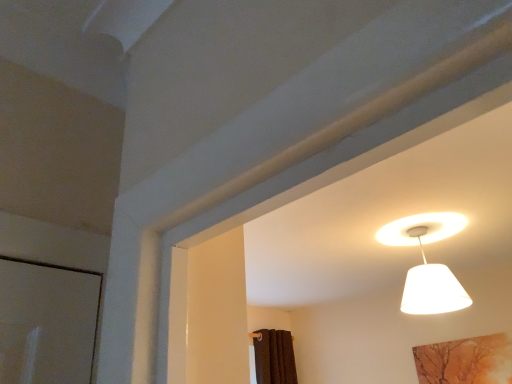
Where is `white fabric lampshade at upper right`? The height and width of the screenshot is (384, 512). white fabric lampshade at upper right is located at coordinates pos(426,263).

Describe the element at coordinates (426, 263) in the screenshot. The image size is (512, 384). I see `white fabric lampshade at upper right` at that location.

Where is `white fabric lampshade at upper right`? The height and width of the screenshot is (384, 512). white fabric lampshade at upper right is located at coordinates (426, 263).